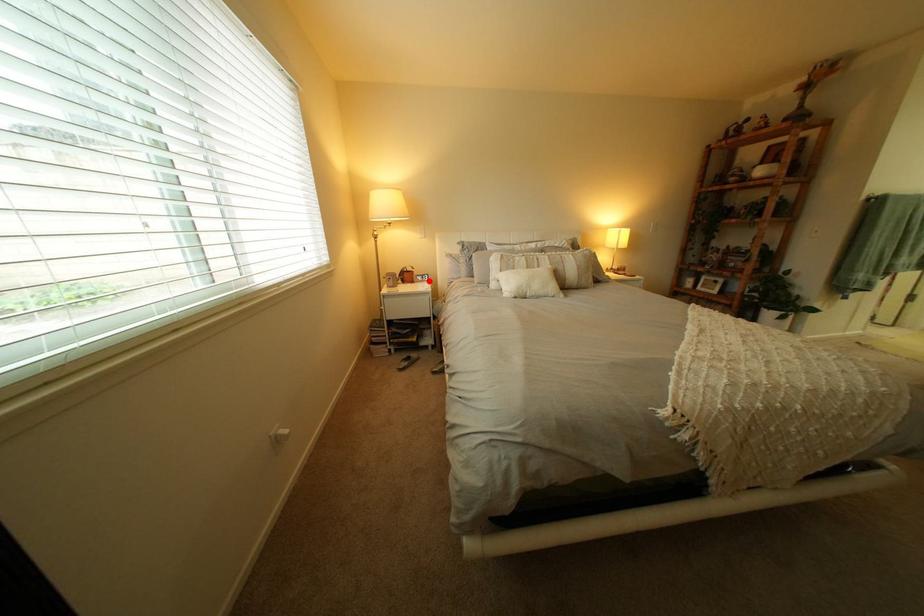
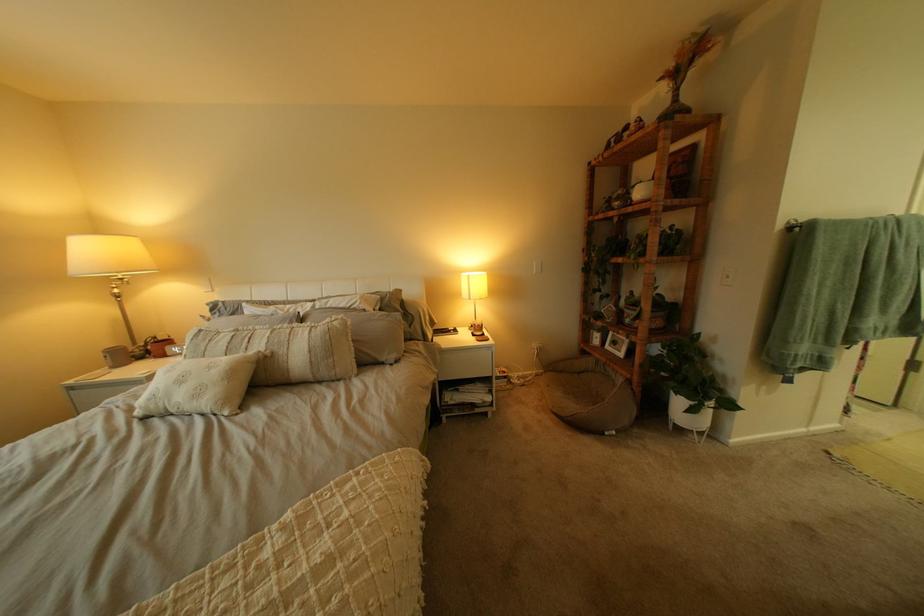
Question: A red point is marked in image1. In image2, is the corresponding 3D point closer to the camera or farther? Reply with the corresponding letter.

Choices:
 (A) The corresponding 3D point is closer.
 (B) The corresponding 3D point is farther.

Answer: (B)